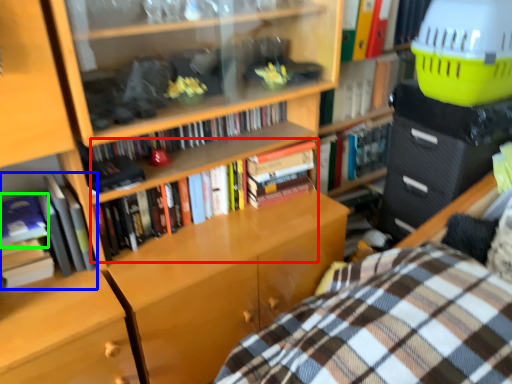
Question: Which object is positioned farthest from book (highlighted by a red box)? Select from book (highlighted by a blue box) and book (highlighted by a green box).

Choices:
 (A) book
 (B) book

Answer: (B)